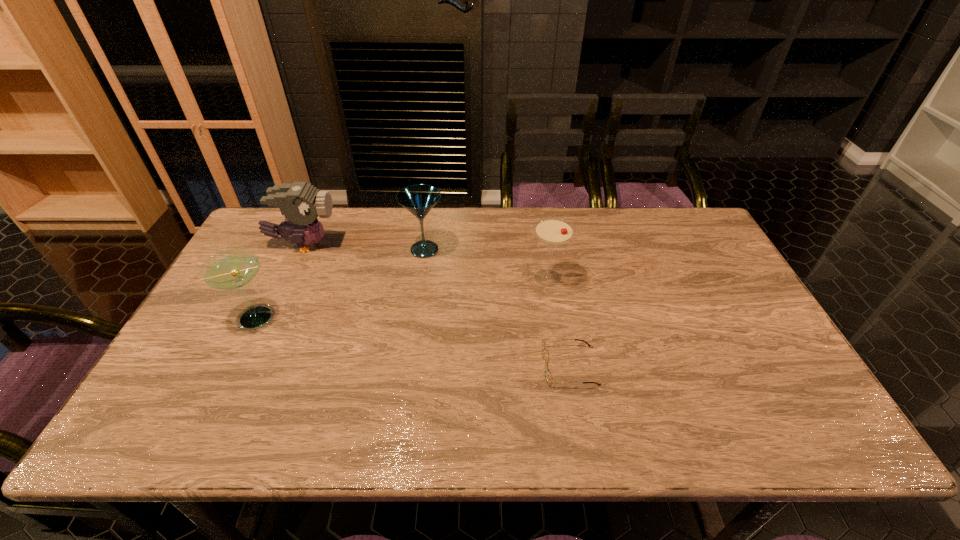
Where is `free space between the second martini from left to right and the fourth farthest object`? The width and height of the screenshot is (960, 540). free space between the second martini from left to right and the fourth farthest object is located at coordinates (341, 284).

The image size is (960, 540). What are the coordinates of `vacant area that lies between the spectacles and the leftmost martini` in the screenshot? It's located at (414, 341).

You are a GUI agent. You are given a task and a screenshot of the screen. Output one action in this format:
    pyautogui.click(x=<x>, y=<y>)
    Task: Click on the vacant point located between the third nearest object and the nearest martini
    The image size is (960, 540).
    Given the screenshot: What is the action you would take?
    (x=402, y=298)

This screenshot has height=540, width=960. Find the location of `empty space that is in between the nearest martini and the bird`. empty space that is in between the nearest martini and the bird is located at coordinates (280, 281).

Select which object appears as the second closest to the leftmost martini. Please provide its 2D coordinates. Your answer should be formatted as a tuple, i.e. [(x, y)], where the tuple contains the x and y coordinates of a point satisfying the conditions above.

[(418, 199)]

At what (x,y) coordinates should I click in order to perform the action: click on the second closest object relative to the second nearest martini. Please return your answer as a coordinate pair (x, y). The image size is (960, 540). Looking at the image, I should click on (418, 199).

Identify the location of martini that is the nearest to the second martini from left to right. (553, 231).

Point out which martini is positioned as the second nearest to the nearest object. Please provide its 2D coordinates. Your answer should be formatted as a tuple, i.e. [(x, y)], where the tuple contains the x and y coordinates of a point satisfying the conditions above.

[(418, 199)]

Identify the location of blank area in the image that satisfies the following two spatial constraints: 1. on the back side of the second nearest martini; 2. on the left side of the leftmost martini. (276, 278).

I want to click on free space that satisfies the following two spatial constraints: 1. at the beak of the bird; 2. on the left side of the farthest martini, so click(301, 249).